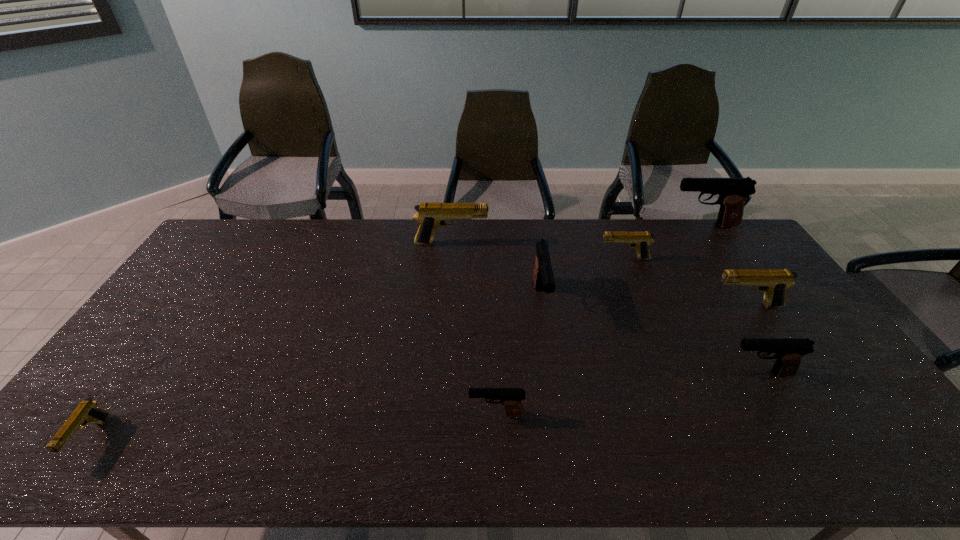
In order to click on object that is the sixth closest to the third farthest tan pistol in this screenshot , I will do `click(431, 216)`.

Select which pistol appears as the third closest to the leftmost pistol. Please provide its 2D coordinates. Your answer should be formatted as a tuple, i.e. [(x, y)], where the tuple contains the x and y coordinates of a point satisfying the conditions above.

[(543, 277)]

Find the location of a particular element. This screenshot has width=960, height=540. pistol identified as the fourth closest to the second smallest black pistol is located at coordinates (511, 398).

Select which black pistol is the fourth closest to the fifth pistol from left to right. Please provide its 2D coordinates. Your answer should be formatted as a tuple, i.e. [(x, y)], where the tuple contains the x and y coordinates of a point satisfying the conditions above.

[(511, 398)]

Choose which black pistol is the nearest neighbor to the second smallest black pistol. Please provide its 2D coordinates. Your answer should be formatted as a tuple, i.e. [(x, y)], where the tuple contains the x and y coordinates of a point satisfying the conditions above.

[(543, 277)]

Find the location of `the closest tan pistol relative to the leftmost black pistol`. the closest tan pistol relative to the leftmost black pistol is located at coordinates (641, 240).

Locate an element on the screen. The image size is (960, 540). the closest tan pistol to the leftmost object is located at coordinates (431, 216).

This screenshot has width=960, height=540. I want to click on vacant space that satisfies the following two spatial constraints: 1. at the barrel of the leftmost black pistol; 2. at the barrel of the leftmost pistol, so click(497, 439).

Locate an element on the screen. The width and height of the screenshot is (960, 540). vacant area in the image that satisfies the following two spatial constraints: 1. at the barrel of the third nearest object; 2. at the barrel of the leftmost object is located at coordinates (797, 439).